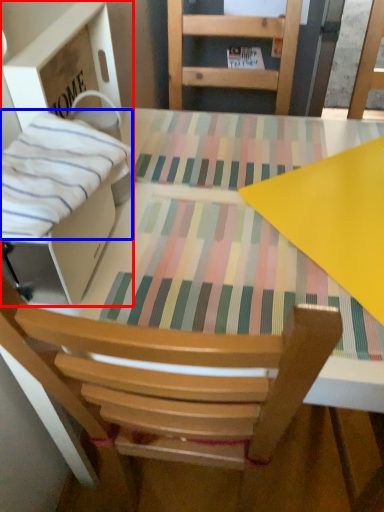
Question: Which of the following is the farthest to the observer, cardboard box (highlighted by a red box) or blanket (highlighted by a blue box)?

Choices:
 (A) cardboard box
 (B) blanket

Answer: (A)